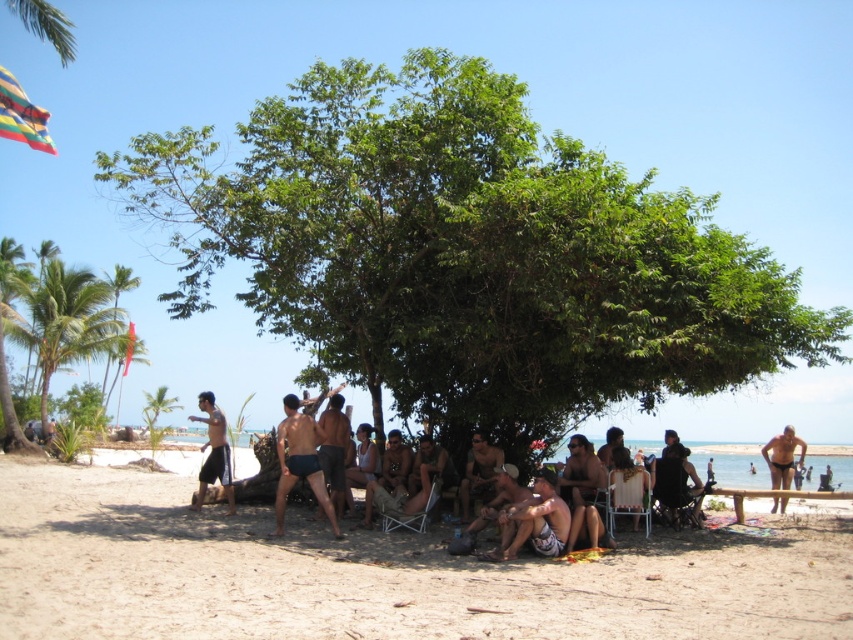
You are planning to set up a small picnic area near the green leafy tree at left and the metallic silver chair at center. Which object takes up more horizontal space?

The green leafy tree at left has a greater width than the metallic silver chair at center, so it occupies more horizontal space.

You are a photographer wanting to capture a photo of the green leafy tree at left and the beige fabric shorts at center. Since you want both subjects to appear clearly in the frame, which object should you focus on first to ensure proper focus?

The green leafy tree at left is bigger than the beige fabric shorts at center, so you should focus on the green leafy tree at left first to ensure proper focus since it is larger and more prominent in the frame.

In the scene shown: You are a photographer standing at the beach and want to take a photo that includes both the green leafy tree at left and the beige fabric shorts at center. Which object should you adjust your camera focus to first to ensure both are in the frame?

The green leafy tree at left is further to the viewer than the beige fabric shorts at center, so you should focus on the green leafy tree at left first to ensure both are in the frame.